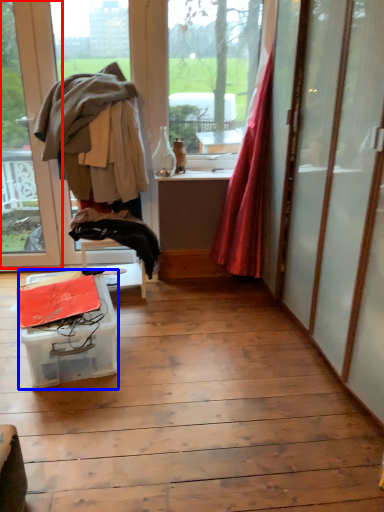
Question: Which point is further to the camera, window (highlighted by a red box) or table (highlighted by a blue box)?

Choices:
 (A) window
 (B) table

Answer: (A)